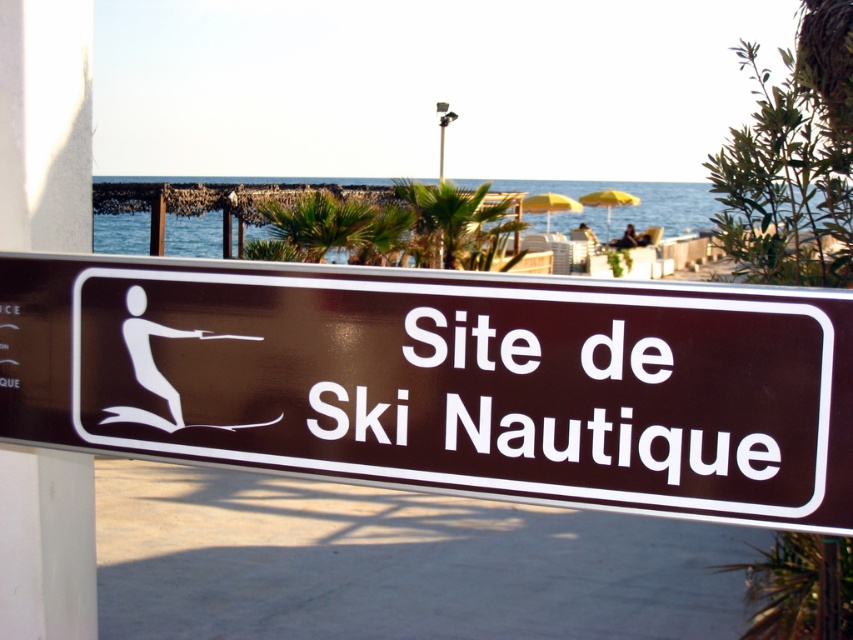
You are designing a new signboard and want to place a logo exactly at the center of the signboard. The current signboard has the white plastic text at center. Where should you place the logo to ensure it is centered?

The white plastic text at center is already positioned at the center of the signboard, so placing the logo there would center it as well.

You are designing a poster for a water sports event and want to ensure the white plastic text at center is more prominent than the green leafy palm tree at center. Based on the scene description, is this currently achievable? Explain why or why not.

The white plastic text at center has a smaller size compared to green leafy palm tree at center. Since the text is smaller, it is less prominent than the palm tree, making it currently not achievable to have the text more prominent without altering its size or the palm tree.

You are a delivery drone that needs to land on the light colored surface where the signboard is mounted. The landing zone must be free of any objects. Is the area around the white plastic text at center safe for landing?

The white plastic text at center is located at point (544, 403), so the area around it might still be clear of other objects. However, since the description only specifies the position of the text and not the surrounding area, it is uncertain if there are other objects nearby. Proceed with caution and visually inspect the area before landing.